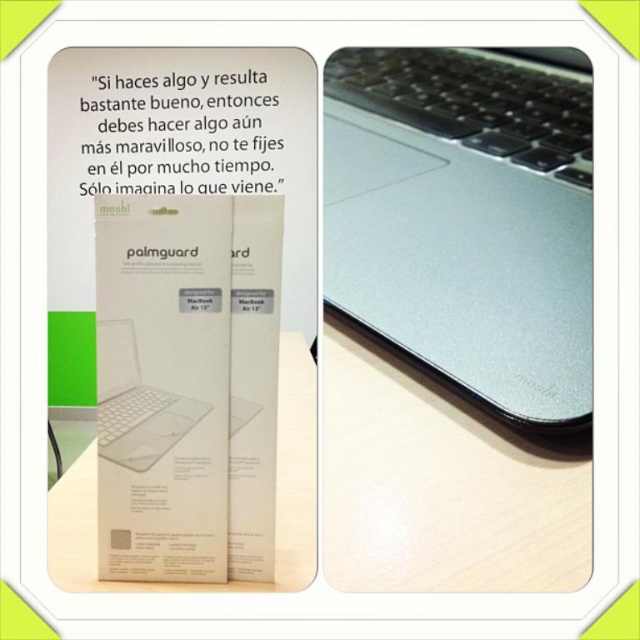
Consider the image. You are looking at two laptops displayed side by side. The scene shows a satin silver laptop at center and a sleek silver laptop at center. Which one is positioned to the right?

The satin silver laptop at center is positioned to the right of the sleek silver laptop at center.

You are a customer at a tech store and see the Moshi Palmguard packaging on the left. You notice a satin silver laptop at center and a wooden table at center. Which object is placed higher in the image?

The satin silver laptop at center is located above the wooden table at center, so it is placed higher in the image.

Consider the image. You are a delivery person who just placed a package on the wooden table at center. The sleek silver laptop at center is on the same table. The package is 12 inches wide. Will the package fit on the table without overlapping the laptop?

The distance between the wooden table at center and the sleek silver laptop at center is 10.35 inches. Since the package is 12 inches wide, it will overlap the laptop as the available space is less than the package width.